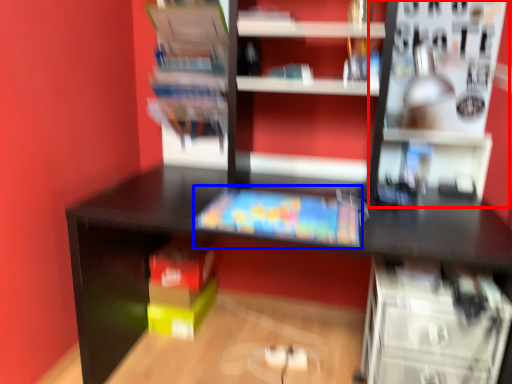
Question: Which of the following is the farthest to the observer, shelf (highlighted by a red box) or book (highlighted by a blue box)?

Choices:
 (A) shelf
 (B) book

Answer: (B)